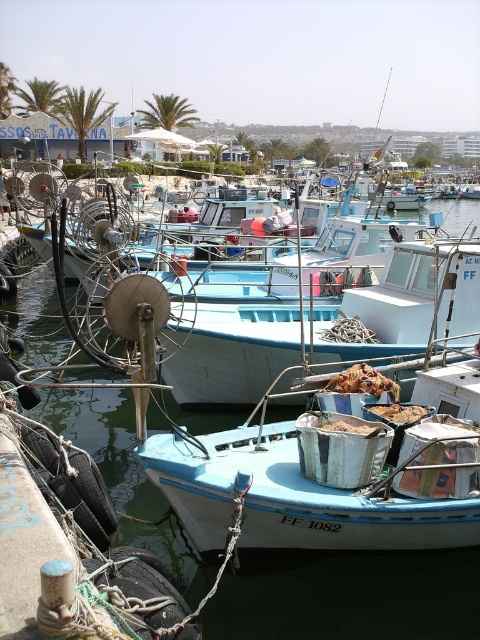
Between point (224, 324) and point (381, 600), which one is positioned behind?

Point (224, 324)

Is white matte boat at center to the right of blue water at center from the viewer's perspective?

Yes, white matte boat at center is to the right of blue water at center.

At what (x,y) coordinates should I click in order to perform the action: click on white matte boat at center. Please return your answer as a coordinate pair (x, y). Looking at the image, I should click on (325, 324).

Describe the element at coordinates (294, 497) in the screenshot. I see `light blue painted wood boat at center` at that location.

Which is more to the right, light blue painted wood boat at center or white matte boat at center?

From the viewer's perspective, white matte boat at center appears more on the right side.

Where is `light blue painted wood boat at center`? The width and height of the screenshot is (480, 640). light blue painted wood boat at center is located at coordinates (294, 497).

Does light blue painted wood boat at center appear over blue water at center?

Incorrect, light blue painted wood boat at center is not positioned above blue water at center.

Does light blue painted wood boat at center have a lesser height compared to blue water at center?

Indeed, light blue painted wood boat at center has a lesser height compared to blue water at center.

Does point (472, 371) lie in front of point (452, 602)?

No, it is not.

This screenshot has height=640, width=480. Find the location of `light blue painted wood boat at center`. light blue painted wood boat at center is located at coordinates (294, 497).